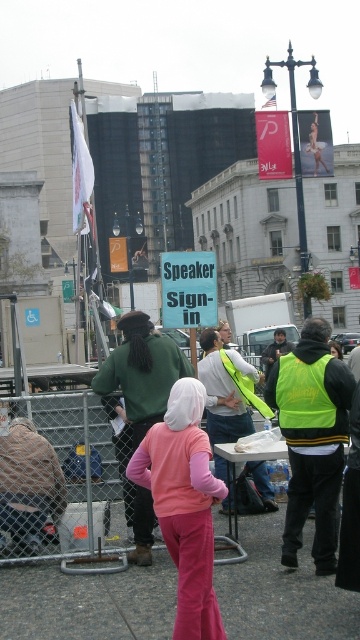
You are a photographer trying to capture a photo of the light pink fleece at center and the neon yellow safety vest at center. From your current position, which one is more to the left?

The light pink fleece at center is more to the left than the neon yellow safety vest at center.

You are a photographer at the event. You need to capture a photo where both the pink fabric pants at lower center and the neon yellow safety vest at center are clearly visible. Considering their sizes, which object should you focus on to ensure both are in frame without cropping?

Since the pink fabric pants at lower center are wider than the neon yellow safety vest at center, you should focus on the pink fabric pants at lower center to ensure both objects fit within the frame.

You are a photographer standing at the edge of the crowd. You want to capture both the light pink fleece at center and the neon yellow safety vest at center in a single photo without moving your position. Can you fit both objects in your camera frame if your camera has a minimum focus range of 3 feet?

The distance between the light pink fleece at center and the neon yellow safety vest at center is 4.06 feet, which exceeds the camera minimum focus range of 3 feet. Therefore, both objects can be captured in a single photo without moving your position.